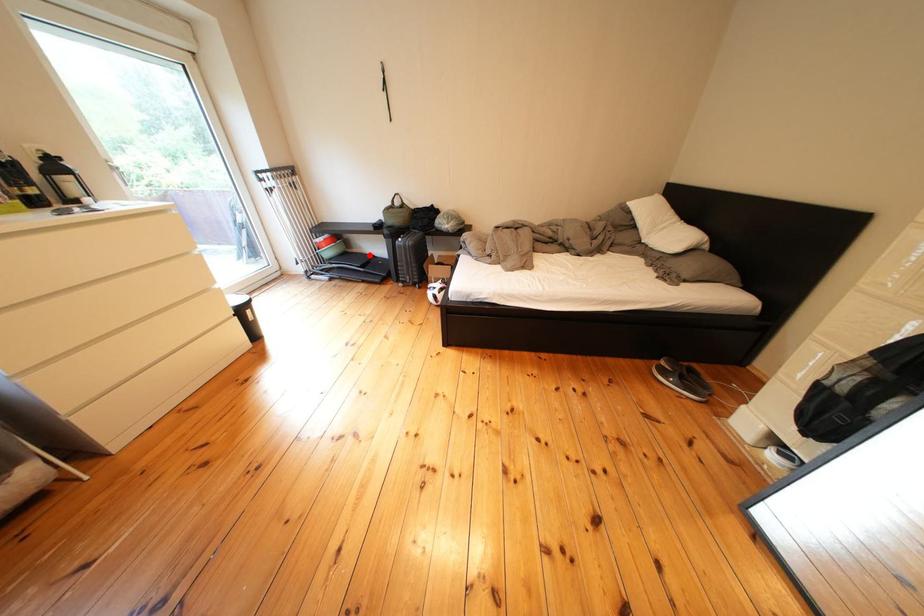
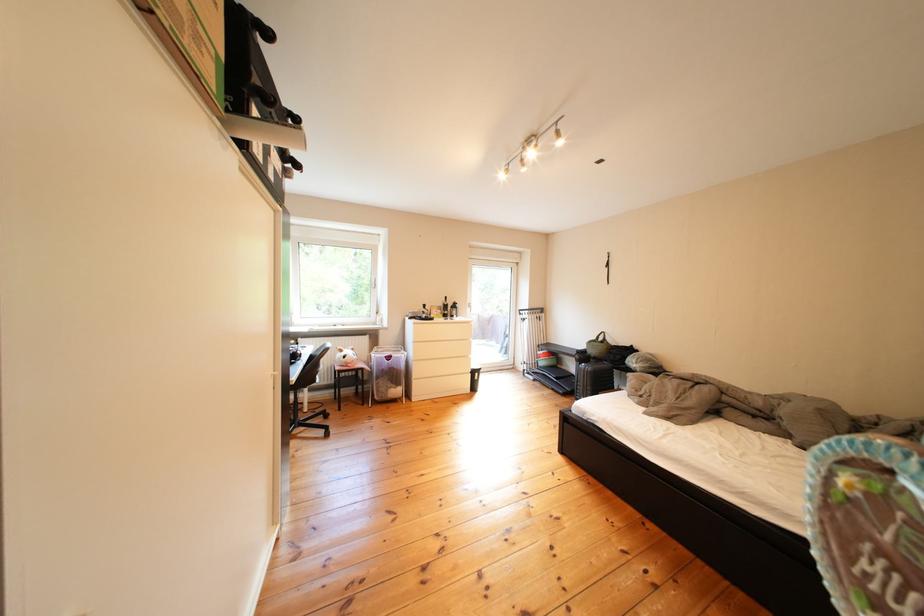
The point at the highlighted location is marked in the first image. Where is the corresponding point in the second image?

(578, 371)